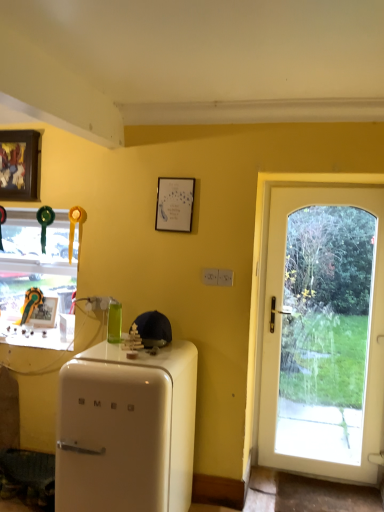
Describe the element at coordinates (174, 204) in the screenshot. I see `white matte picture frame at upper center, marked as the first picture frame in a front-to-back arrangement` at that location.

The image size is (384, 512). I want to click on white matte picture frame at upper center, acting as the third picture frame starting from the left, so click(x=174, y=204).

What are the coordinates of `matte black picture frame at left, the 1th picture frame in the left-to-right sequence` in the screenshot? It's located at (44, 313).

This screenshot has width=384, height=512. What do you see at coordinates (114, 322) in the screenshot?
I see `green glass bottle at center` at bounding box center [114, 322].

Find the location of `white glossy refrigerator at lower left`. white glossy refrigerator at lower left is located at coordinates (126, 430).

In terms of size, does clear glass window at left appear bigger or smaller than green glass bottle at center?

In the image, clear glass window at left appears to be larger than green glass bottle at center.

Is point (55, 282) closer or farther from the camera than point (121, 328)?

Point (55, 282) is farther from the camera than point (121, 328).

Is clear glass window at left wider or thinner than green glass bottle at center?

In the image, clear glass window at left appears to be wider than green glass bottle at center.

How many degrees apart are the facing directions of clear glass window at left and green glass bottle at center?

clear glass window at left and green glass bottle at center are facing 1.29 degrees away from each other.

Based on the photo, from the image's perspective, which is below, matte black picture frame at left, placed as the third picture frame when sorted from top to bottom, or wooden framed artwork at upper left, placed as the second picture frame when sorted from back to front?

matte black picture frame at left, placed as the third picture frame when sorted from top to bottom, appears lower in the image.

Considering the sizes of objects matte black picture frame at left, the first picture frame positioned from the back, and wooden framed artwork at upper left, placed as the second picture frame when sorted from back to front, in the image provided, who is wider, matte black picture frame at left, the first picture frame positioned from the back, or wooden framed artwork at upper left, placed as the second picture frame when sorted from back to front,?

wooden framed artwork at upper left, placed as the second picture frame when sorted from back to front.

Is matte black picture frame at left, the third picture frame from the right, positioned with its back to wooden framed artwork at upper left, positioned as the 1th picture frame in top-to-bottom order?

matte black picture frame at left, the third picture frame from the right, is not turned away from wooden framed artwork at upper left, positioned as the 1th picture frame in top-to-bottom order.

Is point (54, 317) more distant than point (17, 156)?

Yes, it is.

From a real-world perspective, is white glossy refrigerator at lower left located higher than wooden framed artwork at upper left, acting as the 3th picture frame starting from the bottom?

No, from a real-world perspective, white glossy refrigerator at lower left is not over wooden framed artwork at upper left, acting as the 3th picture frame starting from the bottom

Measure the distance from white glossy refrigerator at lower left to wooden framed artwork at upper left, positioned as the second picture frame in left-to-right order.

The distance of white glossy refrigerator at lower left from wooden framed artwork at upper left, positioned as the second picture frame in left-to-right order, is 1.48 meters.

Does white glossy refrigerator at lower left appear on the left side of wooden framed artwork at upper left, marked as the 2th picture frame in a front-to-back arrangement?

In fact, white glossy refrigerator at lower left is to the right of wooden framed artwork at upper left, marked as the 2th picture frame in a front-to-back arrangement.

Is white glossy refrigerator at lower left next to wooden framed artwork at upper left, marked as the 2th picture frame in a front-to-back arrangement, and touching it?

No, white glossy refrigerator at lower left is not with wooden framed artwork at upper left, marked as the 2th picture frame in a front-to-back arrangement.

Based on the photo, can you confirm if matte black picture frame at left, the first picture frame positioned from the back, is smaller than white matte picture frame at upper center, arranged as the 2th picture frame when ordered from the bottom?

Actually, matte black picture frame at left, the first picture frame positioned from the back, might be larger than white matte picture frame at upper center, arranged as the 2th picture frame when ordered from the bottom.

Find the location of `the 2nd picture frame behind when counting from the white matte picture frame at upper center, the 2th picture frame in the top-to-bottom sequence`. the 2nd picture frame behind when counting from the white matte picture frame at upper center, the 2th picture frame in the top-to-bottom sequence is located at coordinates (44, 313).

Is matte black picture frame at left, the third picture frame from the right, looking in the opposite direction of white matte picture frame at upper center, the 2th picture frame in the top-to-bottom sequence?

No, white matte picture frame at upper center, the 2th picture frame in the top-to-bottom sequence, is not at the back of matte black picture frame at left, the third picture frame from the right.

Do you think matte black picture frame at left, the third picture frame from the right, is within white matte picture frame at upper center, which is counted as the third picture frame, starting from the back, or outside of it?

matte black picture frame at left, the third picture frame from the right, exists outside the volume of white matte picture frame at upper center, which is counted as the third picture frame, starting from the back.

Between white glossy refrigerator at lower left and matte black picture frame at left, placed as the third picture frame when sorted from top to bottom, which one appears on the right side from the viewer's perspective?

white glossy refrigerator at lower left is more to the right.

Can you confirm if white glossy refrigerator at lower left is bigger than matte black picture frame at left, the 1th picture frame in the left-to-right sequence?

Indeed, white glossy refrigerator at lower left has a larger size compared to matte black picture frame at left, the 1th picture frame in the left-to-right sequence.

Would you say white glossy refrigerator at lower left is outside matte black picture frame at left, which is counted as the 1th picture frame, starting from the bottom?

white glossy refrigerator at lower left is positioned outside matte black picture frame at left, which is counted as the 1th picture frame, starting from the bottom.

Consider the image. Can you tell me how much white glossy refrigerator at lower left and white glass door at right differ in facing direction?

They differ by 0.527 degrees in their facing directions.

In terms of size, does white glossy refrigerator at lower left appear bigger or smaller than white glass door at right?

Clearly, white glossy refrigerator at lower left is larger in size than white glass door at right.

In order to click on door to the right of white glossy refrigerator at lower left in this screenshot , I will do `click(324, 332)`.

What's the angular difference between clear glass window at left and white glossy refrigerator at lower left's facing directions?

The angle between the facing direction of clear glass window at left and the facing direction of white glossy refrigerator at lower left is 1.36 degrees.

Is clear glass window at left turned away from white glossy refrigerator at lower left?

No, clear glass window at left's orientation is not away from white glossy refrigerator at lower left.

From the image's perspective, which object appears higher, clear glass window at left or white glossy refrigerator at lower left?

clear glass window at left appears higher in the image.

Does clear glass window at left have a smaller size compared to white glossy refrigerator at lower left?

Indeed, clear glass window at left has a smaller size compared to white glossy refrigerator at lower left.

Locate an element on the screen. The height and width of the screenshot is (512, 384). window behind the green glass bottle at center is located at coordinates (36, 280).

From a real-world perspective, starting from the matte black picture frame at left, the first picture frame positioned from the back, which picture frame is the 2nd one vertically above it? Please provide its 2D coordinates.

[(19, 165)]

Which object lies further to the anchor point white matte picture frame at upper center, marked as the first picture frame in a front-to-back arrangement, white glossy refrigerator at lower left or green glass bottle at center?

white glossy refrigerator at lower left is further to white matte picture frame at upper center, marked as the first picture frame in a front-to-back arrangement.

From the picture: Looking at the image, which one is located closer to clear glass window at left, green glass bottle at center or white matte picture frame at upper center, acting as the third picture frame starting from the left?

green glass bottle at center is closer to clear glass window at left.

When comparing their distances from wooden framed artwork at upper left, positioned as the 1th picture frame in top-to-bottom order, does white glossy refrigerator at lower left or white glass door at right seem further?

white glass door at right lies further to wooden framed artwork at upper left, positioned as the 1th picture frame in top-to-bottom order, than the other object.

Estimate the real-world distances between objects in this image. Which object is further from clear glass window at left, matte black picture frame at left, the 1th picture frame in the left-to-right sequence, or white glass door at right?

Based on the image, white glass door at right appears to be further to clear glass window at left.

From the image, which object appears to be farther from matte black picture frame at left, placed as the third picture frame when sorted from top to bottom, white glass door at right or white matte picture frame at upper center, arranged as the 2th picture frame when ordered from the bottom?

white glass door at right lies further to matte black picture frame at left, placed as the third picture frame when sorted from top to bottom, than the other object.

From the image, which object appears to be farther from clear glass window at left, white glass door at right or matte black picture frame at left, placed as the third picture frame when sorted from top to bottom?

white glass door at right is further to clear glass window at left.

Based on their spatial positions, is white glossy refrigerator at lower left or matte black picture frame at left, the 1th picture frame in the left-to-right sequence, closer to white glass door at right?

Among the two, white glossy refrigerator at lower left is located nearer to white glass door at right.

Which object lies further to the anchor point white glass door at right, wooden framed artwork at upper left, the 2th picture frame when ordered from right to left, or clear glass window at left?

wooden framed artwork at upper left, the 2th picture frame when ordered from right to left.

The width and height of the screenshot is (384, 512). In order to click on picture frame between matte black picture frame at left, the third picture frame from the right, and white matte picture frame at upper center, the 2th picture frame in the top-to-bottom sequence in this screenshot , I will do `click(19, 165)`.

Locate an element on the screen. The image size is (384, 512). window that lies between wooden framed artwork at upper left, placed as the second picture frame when sorted from back to front, and green glass bottle at center from top to bottom is located at coordinates (36, 280).

Image resolution: width=384 pixels, height=512 pixels. What are the coordinates of `bottle between wooden framed artwork at upper left, acting as the 3th picture frame starting from the bottom, and matte black picture frame at left, the third picture frame from the right, from top to bottom` in the screenshot? It's located at (114, 322).

Find the location of a particular element. bottle between clear glass window at left and white glass door at right from left to right is located at coordinates (114, 322).